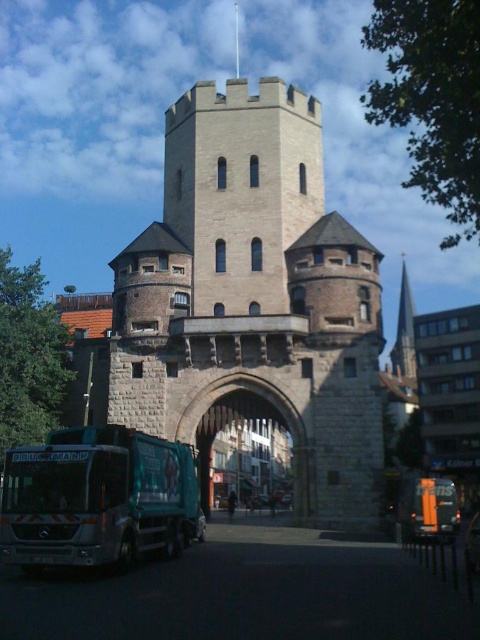
Question: Is beige stone tower at center bigger than stone archway at center?

Choices:
 (A) yes
 (B) no

Answer: (A)

Question: Which of the following is the closest to the observer?

Choices:
 (A) (253, 385)
 (B) (141, 452)
 (C) (436, 493)

Answer: (B)

Question: Can you confirm if green metallic bus at lower left is smaller than stone archway at center?

Choices:
 (A) no
 (B) yes

Answer: (A)

Question: In this image, where is stone archway at center located relative to orange matte tour bus at lower right?

Choices:
 (A) right
 (B) left

Answer: (B)

Question: Which object is positioned closest to the orange matte tour bus at lower right?

Choices:
 (A) green metallic bus at lower left
 (B) stone archway at center

Answer: (B)

Question: Which point appears farthest from the camera in this image?

Choices:
 (A) (425, 534)
 (B) (158, 449)

Answer: (A)